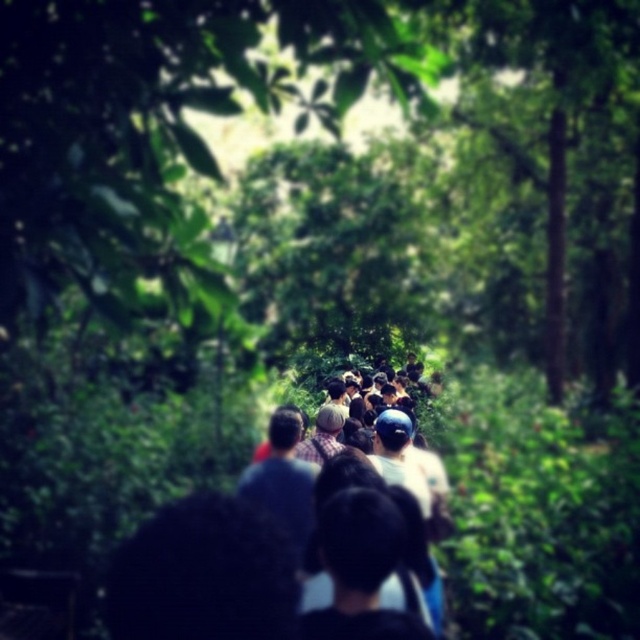
Does green leafy tree at center have a lesser width compared to dark hair at center?

Yes.

How much distance is there between green leafy tree at center and dark hair at center?

green leafy tree at center and dark hair at center are 5.55 feet apart from each other.

Does point (349, 56) lie behind point (205, 632)?

That is False.

You are a GUI agent. You are given a task and a screenshot of the screen. Output one action in this format:
    pyautogui.click(x=<x>, y=<y>)
    Task: Click on the green leafy tree at center
    The height and width of the screenshot is (640, 640).
    Given the screenshot: What is the action you would take?
    pyautogui.click(x=156, y=134)